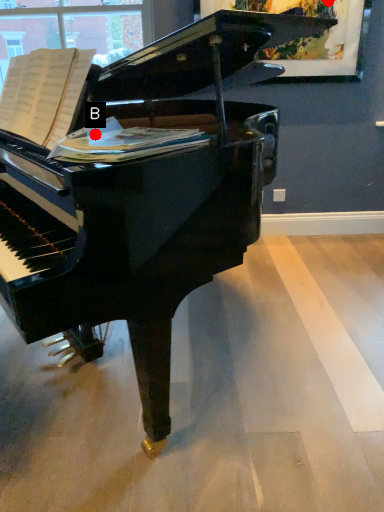
Question: Two points are circled on the image, labeled by A and B beside each circle. Which point is further to the camera?

Choices:
 (A) A is further
 (B) B is further

Answer: (A)